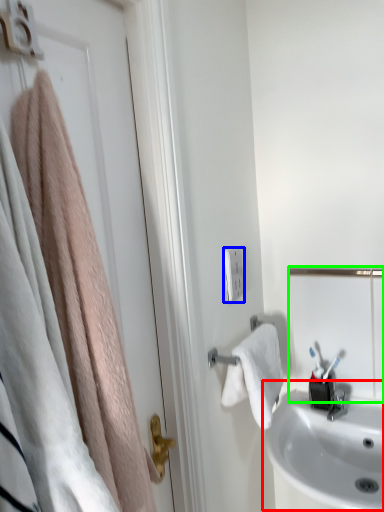
Question: Considering the real-world distances, which object is farthest from sink (highlighted by a red box)? light switch (highlighted by a blue box) or mirror (highlighted by a green box)?

Choices:
 (A) light switch
 (B) mirror

Answer: (A)